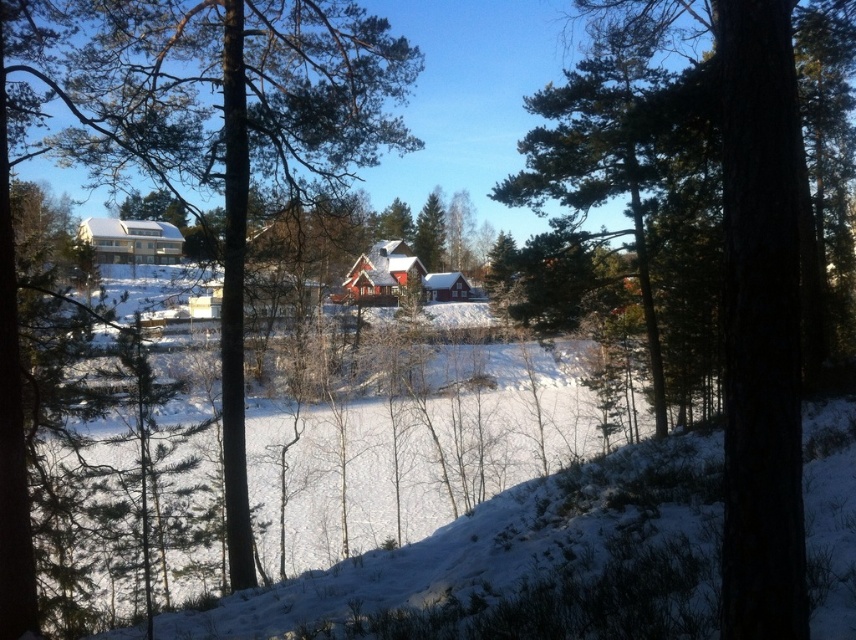
Question: Which of the following is the farthest from the observer?

Choices:
 (A) (152, 230)
 (B) (777, 61)

Answer: (A)

Question: Is white matte cabin at center smaller than red wooden cabin at center?

Choices:
 (A) no
 (B) yes

Answer: (A)

Question: Which point appears farthest from the camera in this image?

Choices:
 (A) (116, 253)
 (B) (343, 296)
 (C) (788, 285)

Answer: (A)

Question: Can you confirm if green textured tree at center is positioned to the left of red wooden cabin at center?

Choices:
 (A) yes
 (B) no

Answer: (B)

Question: Can you confirm if white matte cabin at center is positioned below white wooden cabin at center?

Choices:
 (A) no
 (B) yes

Answer: (A)

Question: Which point is farther to the camera?

Choices:
 (A) (135, 250)
 (B) (770, 208)
 (C) (455, 273)

Answer: (C)